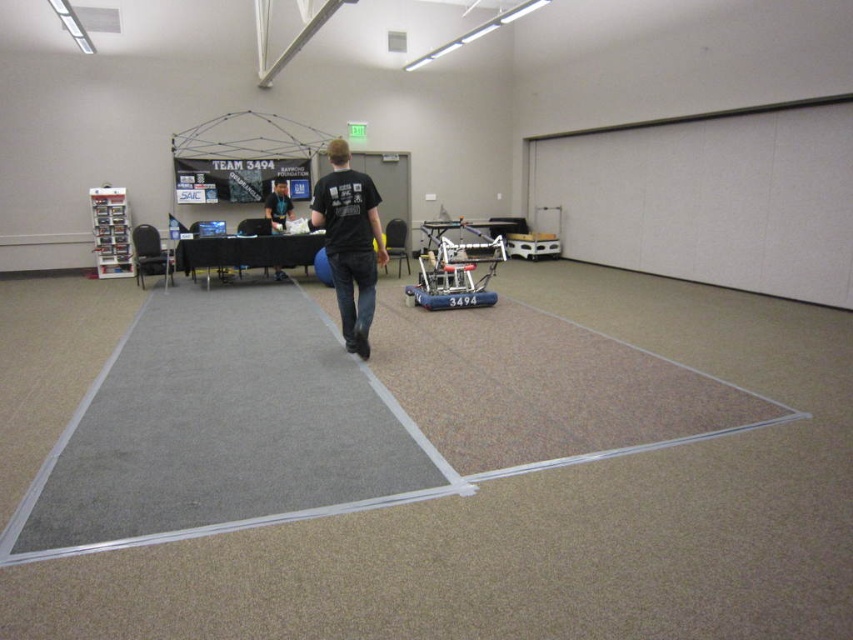
Question: Can you confirm if black cotton shirt at center is positioned to the left of blue rubber robot at center?

Choices:
 (A) yes
 (B) no

Answer: (A)

Question: Which point appears closest to the camera in this image?

Choices:
 (A) pyautogui.click(x=341, y=314)
 (B) pyautogui.click(x=281, y=216)
 (C) pyautogui.click(x=463, y=241)

Answer: (A)

Question: Is the position of black cotton shirt at center less distant than that of blue rubber robot at center?

Choices:
 (A) no
 (B) yes

Answer: (B)

Question: Is black cotton shirt at center wider than black matte shirt at center?

Choices:
 (A) no
 (B) yes

Answer: (B)

Question: Which point is farther from the camera taking this photo?

Choices:
 (A) (334, 205)
 (B) (271, 193)

Answer: (B)

Question: Which of the following is the farthest from the observer?

Choices:
 (A) (281, 204)
 (B) (363, 216)

Answer: (A)